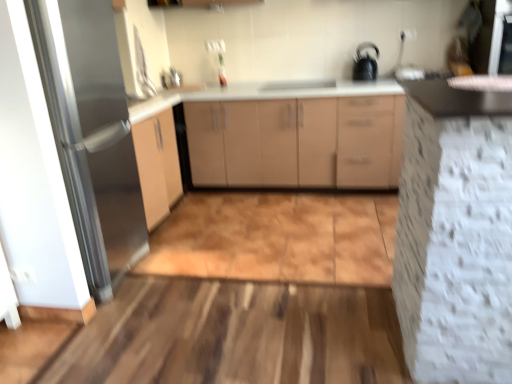
Question: Is matte beige cabinet at center, the 1th cabinetry when ordered from back to front, inside white textured cabinet at right, which is the second cabinetry in back-to-front order?

Choices:
 (A) yes
 (B) no

Answer: (B)

Question: Could you tell me if white textured cabinet at right, the 1th cabinetry from the front, is turned towards matte beige cabinet at center, the 1th cabinetry when ordered from back to front?

Choices:
 (A) no
 (B) yes

Answer: (A)

Question: Considering the relative sizes of white textured cabinet at right, which is the second cabinetry in back-to-front order, and matte beige cabinet at center, the 1th cabinetry when ordered from back to front, in the image provided, is white textured cabinet at right, which is the second cabinetry in back-to-front order, wider than matte beige cabinet at center, the 1th cabinetry when ordered from back to front,?

Choices:
 (A) yes
 (B) no

Answer: (A)

Question: From a real-world perspective, does white textured cabinet at right, which is the second cabinetry in back-to-front order, stand above matte beige cabinet at center, positioned as the second cabinetry in front-to-back order?

Choices:
 (A) yes
 (B) no

Answer: (A)

Question: Can you confirm if white textured cabinet at right, which is the second cabinetry in back-to-front order, is shorter than matte beige cabinet at center, positioned as the second cabinetry in front-to-back order?

Choices:
 (A) yes
 (B) no

Answer: (B)

Question: Is white textured cabinet at right, the 1th cabinetry from the front, to the left of matte beige cabinet at center, positioned as the second cabinetry in front-to-back order, from the viewer's perspective?

Choices:
 (A) yes
 (B) no

Answer: (B)

Question: Is black glossy kettle at upper right smaller than satin nickel faucet at upper center?

Choices:
 (A) yes
 (B) no

Answer: (B)

Question: Is black glossy kettle at upper right to the right of satin nickel faucet at upper center from the viewer's perspective?

Choices:
 (A) no
 (B) yes

Answer: (B)

Question: Is black glossy kettle at upper right positioned beyond the bounds of satin nickel faucet at upper center?

Choices:
 (A) no
 (B) yes

Answer: (B)

Question: Can you confirm if black glossy kettle at upper right is thinner than satin nickel faucet at upper center?

Choices:
 (A) no
 (B) yes

Answer: (A)

Question: Considering the relative sizes of black glossy kettle at upper right and satin nickel faucet at upper center in the image provided, is black glossy kettle at upper right bigger than satin nickel faucet at upper center?

Choices:
 (A) no
 (B) yes

Answer: (B)

Question: Is satin nickel faucet at upper center located within black glossy kettle at upper right?

Choices:
 (A) no
 (B) yes

Answer: (A)

Question: Can you confirm if white textured cabinet at right, which is the second cabinetry in back-to-front order, is positioned to the left of black glossy kettle at upper right?

Choices:
 (A) yes
 (B) no

Answer: (A)